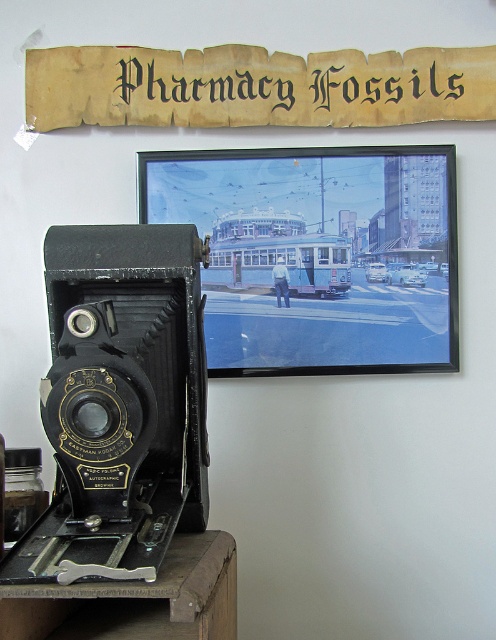
Who is higher up, metallic silver frame at upper center or matte black camera at left?

metallic silver frame at upper center is higher up.

In the scene shown: Who is positioned more to the left, metallic silver frame at upper center or matte black camera at left?

From the viewer's perspective, matte black camera at left appears more on the left side.

Between point (229, 260) and point (117, 497), which one is positioned in front?

Point (117, 497)

Image resolution: width=496 pixels, height=640 pixels. In order to click on metallic silver frame at upper center in this screenshot , I will do `click(318, 253)`.

Between metallic silver frame at upper center and yellowed parchment sign at upper center, which one is positioned higher?

yellowed parchment sign at upper center

Who is positioned more to the right, metallic silver frame at upper center or yellowed parchment sign at upper center?

metallic silver frame at upper center

Which is in front, point (385, 307) or point (30, 77)?

Point (30, 77) is in front.

You are a GUI agent. You are given a task and a screenshot of the screen. Output one action in this format:
    pyautogui.click(x=<x>, y=<y>)
    Task: Click on the metallic silver frame at upper center
    The width and height of the screenshot is (496, 640).
    Given the screenshot: What is the action you would take?
    pyautogui.click(x=318, y=253)

Does matte black camera at left appear under yellowed parchment sign at upper center?

Indeed, matte black camera at left is positioned under yellowed parchment sign at upper center.

Is point (133, 296) closer to camera compared to point (439, 109)?

Yes, point (133, 296) is closer to viewer.

Describe the element at coordinates (120, 403) in the screenshot. I see `matte black camera at left` at that location.

You are a GUI agent. You are given a task and a screenshot of the screen. Output one action in this format:
    pyautogui.click(x=<x>, y=<y>)
    Task: Click on the matte black camera at left
    This screenshot has width=496, height=640.
    Given the screenshot: What is the action you would take?
    pyautogui.click(x=120, y=403)